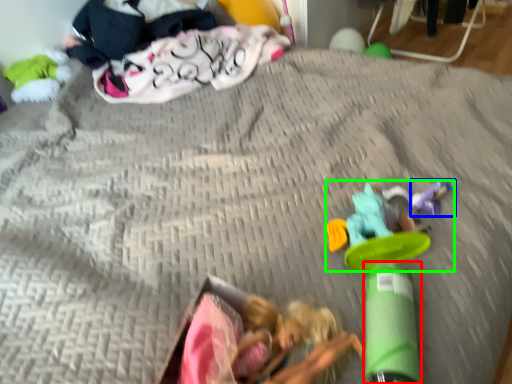
Question: Which object is the closest to the toy (highlighted by a red box)? Choose among these: toy (highlighted by a blue box) or toy (highlighted by a green box).

Choices:
 (A) toy
 (B) toy

Answer: (B)